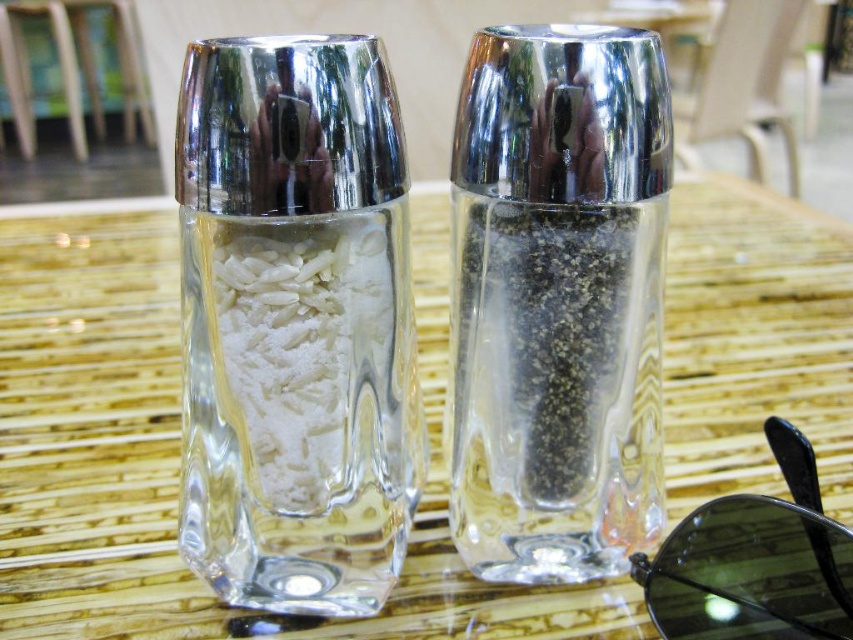
You are setting up a small table for a picnic and need to place both the clear glass salt shaker at center and the clear glass pepper grinder at right. If you want to ensure the salt shaker is not directly underneath the pepper grinder to avoid spills, where should you move the salt shaker?

The clear glass salt shaker at center is currently positioned under the clear glass pepper grinder at right. To prevent spills, move the salt shaker away from the area directly beneath the pepper grinder.

You need to choose a container to hold more salt. Which one between the clear glass salt shaker at center and the clear glass pepper grinder at right should you pick?

The clear glass salt shaker at center has a larger size compared to the clear glass pepper grinder at right, so it can hold more salt.

You are setting up a dining table and need to place the clear glass salt shaker at center. Where should you position it relative to the clear glass table at center?

The clear glass salt shaker at center should be placed on top of the clear glass table at center since the table is below the salt shaker.